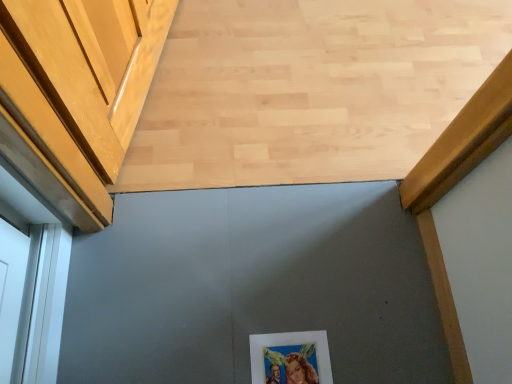
In order to face natural wood floor at center, should I rotate leftwards or rightwards?

You should rotate right by 2.661 degrees.

The image size is (512, 384). What do you see at coordinates (308, 90) in the screenshot?
I see `natural wood floor at center` at bounding box center [308, 90].

Identify the location of natural wood floor at center. Image resolution: width=512 pixels, height=384 pixels. (308, 90).

Locate an element on the screen. The width and height of the screenshot is (512, 384). natural wood floor at center is located at coordinates (308, 90).